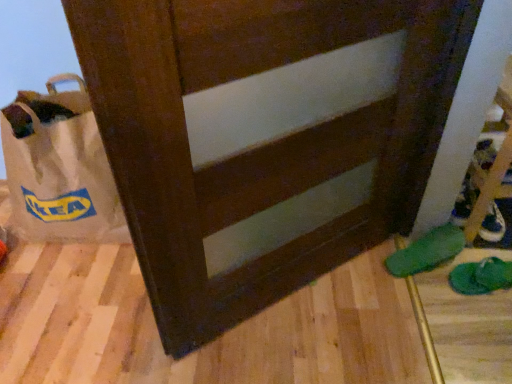
In order to click on vacant space in front of green fabric slipper at lower right, which is counted as the first footwear, starting from the left in this screenshot , I will do `click(454, 304)`.